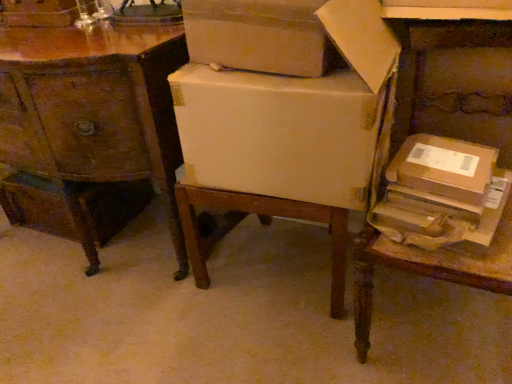
Question: Is wooden desk at center wider or thinner than white cardboard box at upper center?

Choices:
 (A) thin
 (B) wide

Answer: (B)

Question: In the image, is wooden desk at center positioned in front of or behind white cardboard box at upper center?

Choices:
 (A) front
 (B) behind

Answer: (B)

Question: Which is nearer to the wooden drawer at left, which ranks as the second storage box in right-to-left order?

Choices:
 (A) brown wooden table at right
 (B) wooden desk at center
 (C) matte cardboard box at center, the first cardboard box from the left
 (D) white cardboard box at upper center
 (E) brown cardboard box at right, marked as the second cardboard box in a left-to-right arrangement

Answer: (B)

Question: Which object is the closest to the brown wooden table at right?

Choices:
 (A) brown cardboard box at right, the first storage box from the right
 (B) brown cardboard box at right, marked as the second cardboard box in a left-to-right arrangement
 (C) matte cardboard box at center, placed as the 2th cardboard box when sorted from right to left
 (D) white cardboard box at upper center
 (E) wooden desk at center

Answer: (A)